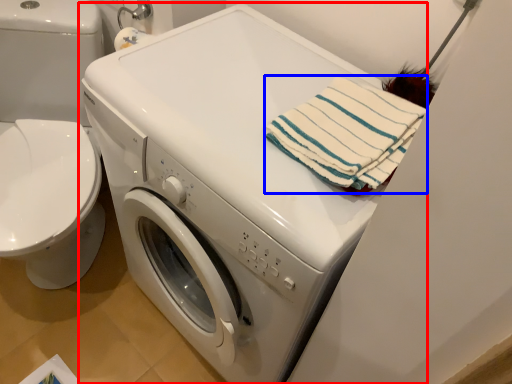
Question: Among these objects, which one is farthest to the camera, washing machine (highlighted by a red box) or beach towel (highlighted by a blue box)?

Choices:
 (A) washing machine
 (B) beach towel

Answer: (B)